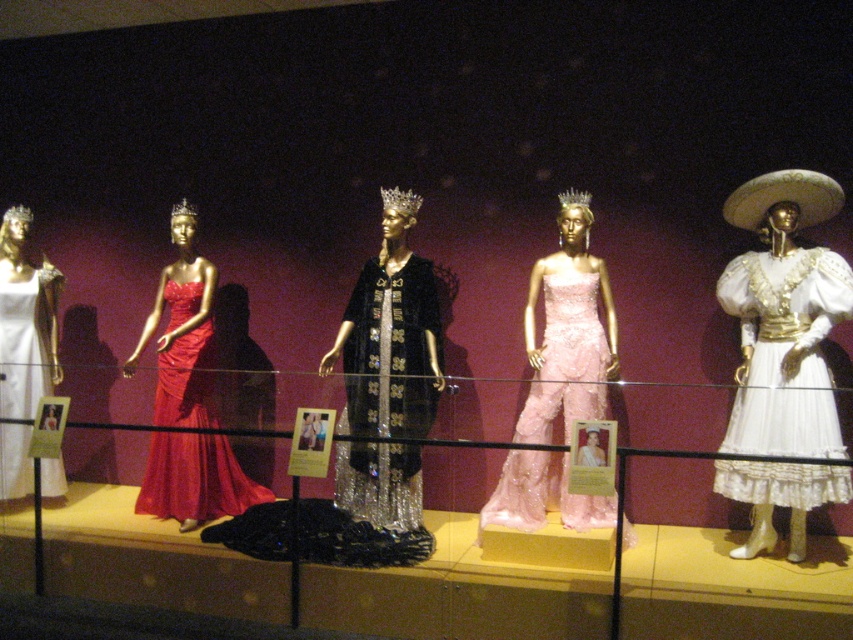
Question: Which point is closer to the camera?

Choices:
 (A) shiny black fabric dress at center
 (B) white satin dress at left
 (C) shiny satin gown at center

Answer: (A)

Question: Is pink satin jumpsuit at center positioned before white satin dress at left?

Choices:
 (A) no
 (B) yes

Answer: (B)

Question: Estimate the real-world distances between objects in this image. Which object is farther from the white lace dress at right?

Choices:
 (A) pink satin jumpsuit at center
 (B) white satin dress at left
 (C) shiny satin gown at center
 (D) shiny black fabric dress at center

Answer: (B)

Question: Is shiny black fabric dress at center bigger than white satin dress at left?

Choices:
 (A) yes
 (B) no

Answer: (A)

Question: Which point is farther to the camera?

Choices:
 (A) shiny satin gown at center
 (B) shiny black fabric dress at center

Answer: (A)

Question: Does white lace dress at right appear over shiny satin gown at center?

Choices:
 (A) no
 (B) yes

Answer: (A)